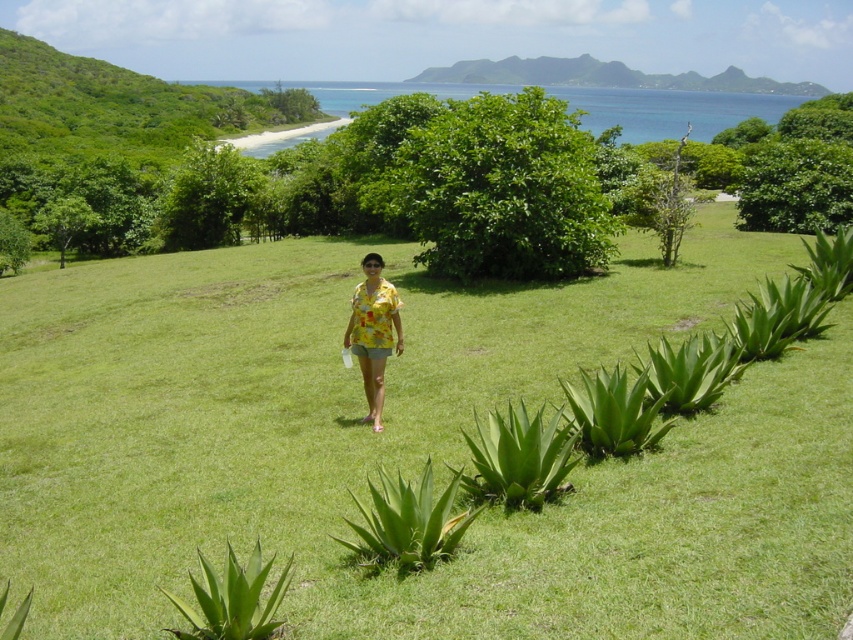
Does point (561, 396) lie behind point (680, 77)?

No, it is in front of (680, 77).

Is point (171, 390) farther from viewer compared to point (511, 76)?

No, (171, 390) is closer to viewer.

The height and width of the screenshot is (640, 853). What are the coordinates of `green grassy at center` in the screenshot? It's located at (410, 445).

In the scene shown: Does green grassy at center have a lesser height compared to yellow printed blouse at center?

Incorrect, green grassy at center's height does not fall short of yellow printed blouse at center's.

You are a GUI agent. You are given a task and a screenshot of the screen. Output one action in this format:
    pyautogui.click(x=<x>, y=<y>)
    Task: Click on the green grassy at center
    
    Given the screenshot: What is the action you would take?
    pyautogui.click(x=410, y=445)

Is green leafy hillside at upper center wider than yellow printed blouse at center?

Indeed, green leafy hillside at upper center has a greater width compared to yellow printed blouse at center.

Consider the image. Can you confirm if green leafy hillside at upper center is positioned to the right of yellow printed blouse at center?

Yes, green leafy hillside at upper center is to the right of yellow printed blouse at center.

The height and width of the screenshot is (640, 853). What are the coordinates of `green leafy hillside at upper center` in the screenshot? It's located at (605, 76).